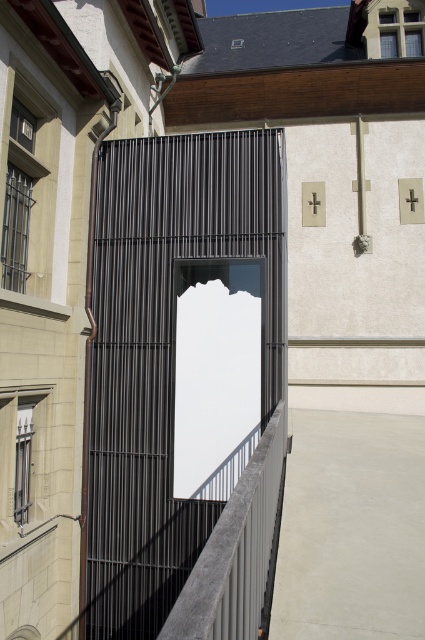
You are a maintenance worker needing to access the smooth concrete hole at lower left. There is a smooth gray metal balustrade at center in the way. Can you move around it to reach the hole?

The smooth gray metal balustrade at center is positioned on the right side of the smooth concrete hole at lower left, so you can move around it from the left side to reach the hole.

Based on the photo, you are a maintenance worker needing to access the smooth concrete hole at lower left. There is a smooth gray metal balustrade at center in your way. Can you step over it to reach the hole?

The smooth gray metal balustrade at center is closer to the viewer than the smooth concrete hole at lower left, so you cannot step over it to reach the hole because the balustrade is in front of the hole and blocking the path.